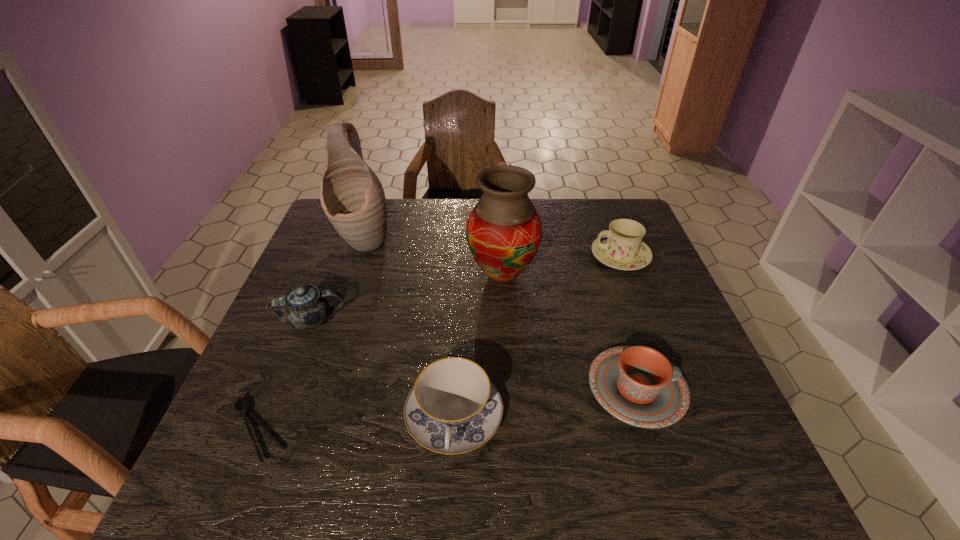
Image resolution: width=960 pixels, height=540 pixels. What are the coordinates of `pitcher` in the screenshot? It's located at (352, 197).

I want to click on vase, so click(x=504, y=230).

Locate an element on the screen. the leftmost chinaware is located at coordinates (305, 307).

Image resolution: width=960 pixels, height=540 pixels. I want to click on the fourth farthest object, so click(305, 307).

This screenshot has height=540, width=960. What are the coordinates of `the farthest chinaware` in the screenshot? It's located at (621, 247).

Find the location of a particular element. Image resolution: width=960 pixels, height=540 pixels. the second chinaware from left to right is located at coordinates (453, 408).

This screenshot has width=960, height=540. Identify the location of the sixth tallest object. coord(638,385).

Image resolution: width=960 pixels, height=540 pixels. In order to click on the shortest object in this screenshot , I will do `click(245, 412)`.

I want to click on vacant space located 0.140m at the spout of the tallest object, so click(346, 295).

Identify the location of free space located on the left of the second tallest object. The width and height of the screenshot is (960, 540). 341,275.